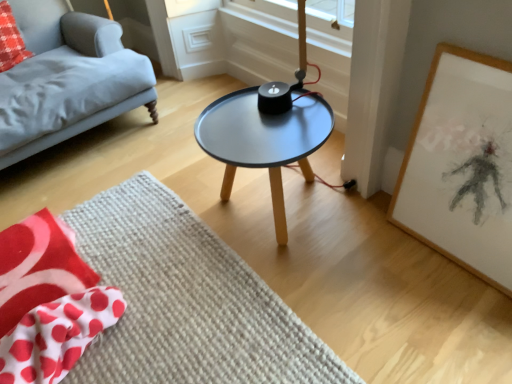
The height and width of the screenshot is (384, 512). In order to click on free space in front of matte black table at center in this screenshot , I will do `click(341, 289)`.